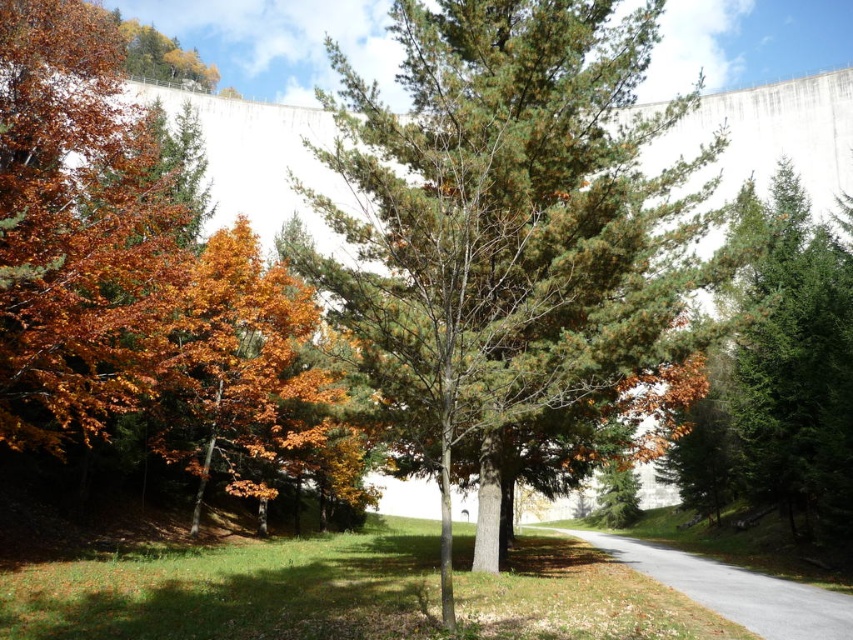
Question: In this image, where is green needle-like at center located relative to orange matte tree at left?

Choices:
 (A) right
 (B) left

Answer: (A)

Question: Which of the following is the closest to the observer?

Choices:
 (A) (180, 289)
 (B) (825, 621)

Answer: (B)

Question: Among these objects, which one is nearest to the camera?

Choices:
 (A) orange matte tree at left
 (B) gray asphalt road at center

Answer: (B)

Question: Which point is closer to the camera?

Choices:
 (A) pyautogui.click(x=515, y=28)
 (B) pyautogui.click(x=193, y=348)
 (C) pyautogui.click(x=720, y=608)

Answer: (C)

Question: Can you confirm if orange-brown foliage at left is wider than orange matte tree at left?

Choices:
 (A) no
 (B) yes

Answer: (B)

Question: Where is green needle-like at center located in relation to orange-brown foliage at left in the image?

Choices:
 (A) above
 (B) below

Answer: (A)